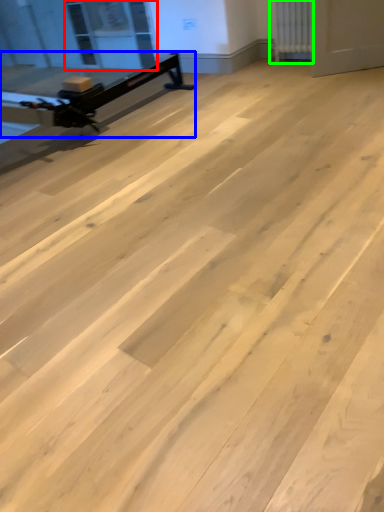
Question: Which is nearer to the window screen (highlighted by a red box)? furniture (highlighted by a blue box) or radiator (highlighted by a green box).

Choices:
 (A) furniture
 (B) radiator

Answer: (A)